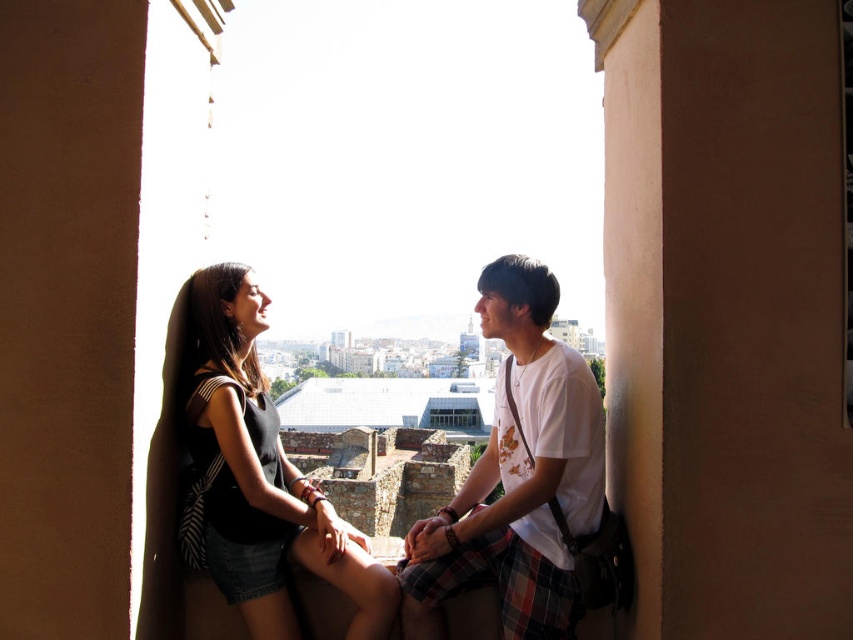
You are an interior designer assessing the space in the image. You need to place a large poster that requires a surface larger than the white cotton shirt at center. Can the smooth beige wall at right accommodate it?

The smooth beige wall at right is smaller than the white cotton shirt at center, so it cannot accommodate the large poster that requires a surface larger than the white cotton shirt at center.

You are standing at the edge of the ledge and want to move closer to the smooth beige wall at right without disturbing the people sitting there. Which direction should you move in relation to the white cotton shirt at center?

You should move towards the right side of the white cotton shirt at center because the smooth beige wall at right is located in front of it.

You are standing at the point with coordinates point (727, 312) in the image. What is the nearest object to you?

The nearest object to you at point (727, 312) is the smooth beige wall at right.